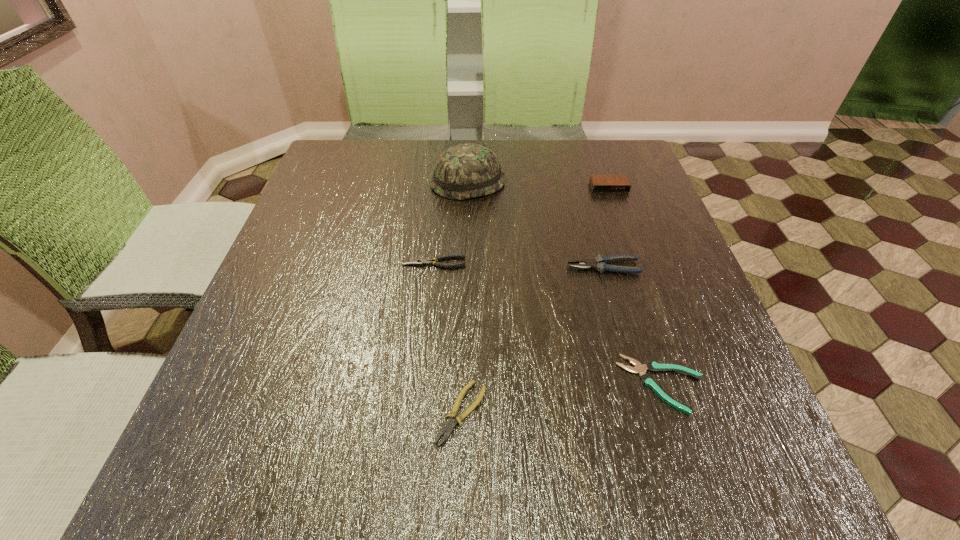
At what (x,y) coordinates should I click in order to perform the action: click on the closest object to the tallest pliers. Please return your answer as a coordinate pair (x, y). This screenshot has width=960, height=540. Looking at the image, I should click on (639, 368).

Identify which pliers is located as the third nearest to the headwear. Please provide its 2D coordinates. Your answer should be formatted as a tuple, i.e. [(x, y)], where the tuple contains the x and y coordinates of a point satisfying the conditions above.

[(639, 368)]

Locate which pliers ranks fourth in proximity to the fifth shortest object. Please provide its 2D coordinates. Your answer should be formatted as a tuple, i.e. [(x, y)], where the tuple contains the x and y coordinates of a point satisfying the conditions above.

[(448, 428)]

Where is `vacant space that satisfies the following two spatial constraints: 1. on the front face of the alarm clock; 2. at the gripping part of the tallest pliers`? vacant space that satisfies the following two spatial constraints: 1. on the front face of the alarm clock; 2. at the gripping part of the tallest pliers is located at coordinates (636, 267).

You are a GUI agent. You are given a task and a screenshot of the screen. Output one action in this format:
    pyautogui.click(x=<x>, y=<y>)
    Task: Click on the vacant space that satisfies the following two spatial constraints: 1. on the front face of the alarm clock; 2. at the gripping part of the fourth shortest object
    This screenshot has width=960, height=540.
    Given the screenshot: What is the action you would take?
    pyautogui.click(x=636, y=267)